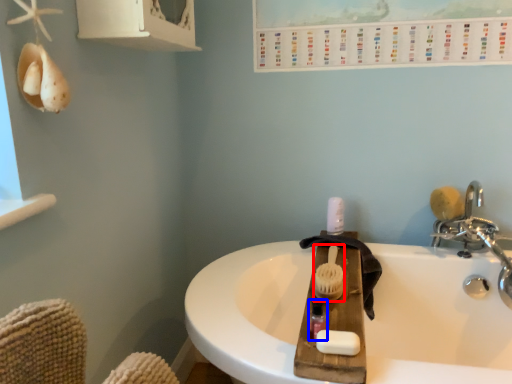
Question: Which point is further to the camera, brush (highlighted by a red box) or mouthwash (highlighted by a blue box)?

Choices:
 (A) brush
 (B) mouthwash

Answer: (A)